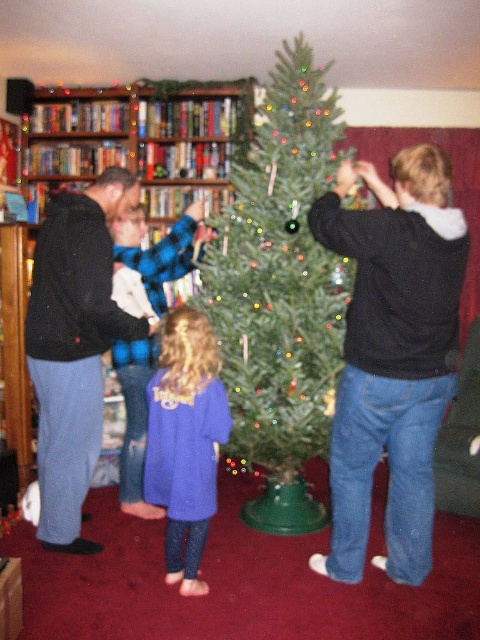
You are standing in the festive living room and want to place a small decoration. You have two options to choose from. The first option is to place it at point [63,392] and the second option is to place it at point [196,140]. Which point is closer to you?

Point [63,392] is closer to the viewer than point [196,140].